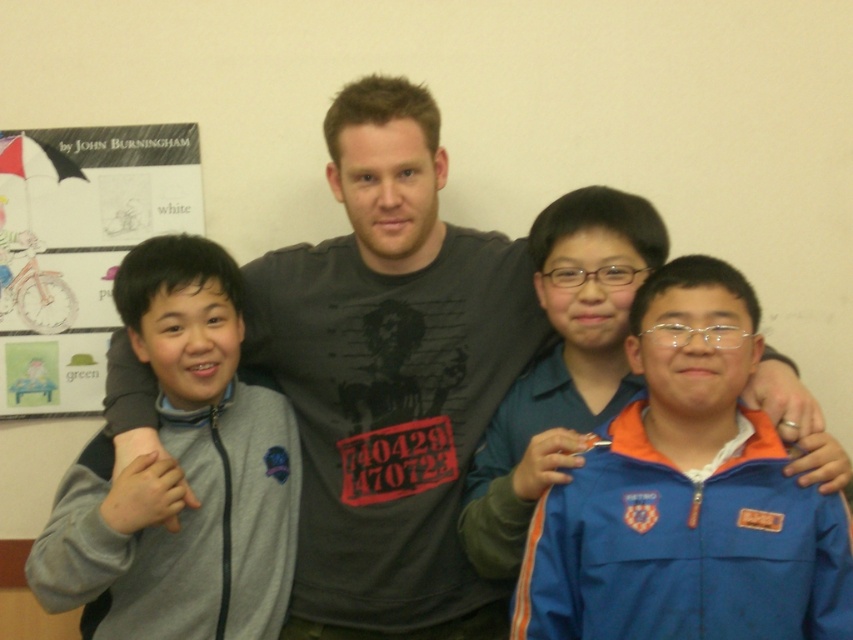
Consider the image. You are standing in front of the group of people in the image. There are two points marked in the scene, one at coordinates point (x=466, y=346) and another at point (x=107, y=600). Which point is closer to you?

Point (x=466, y=346) is further to the viewer than point (x=107, y=600), so the closer point to you is point (x=466, y=346).

You are standing in the room where the four individuals are posing. You want to place a small sticker exactly halfway between point A at point (688, 324) and point B at point (102, 476). Will the sticker be closer to point A or point B?

The sticker placed halfway between point A at point (688, 324) and point B at point (102, 476) will be closer to point B because the halfway point is closer to point B than point A.